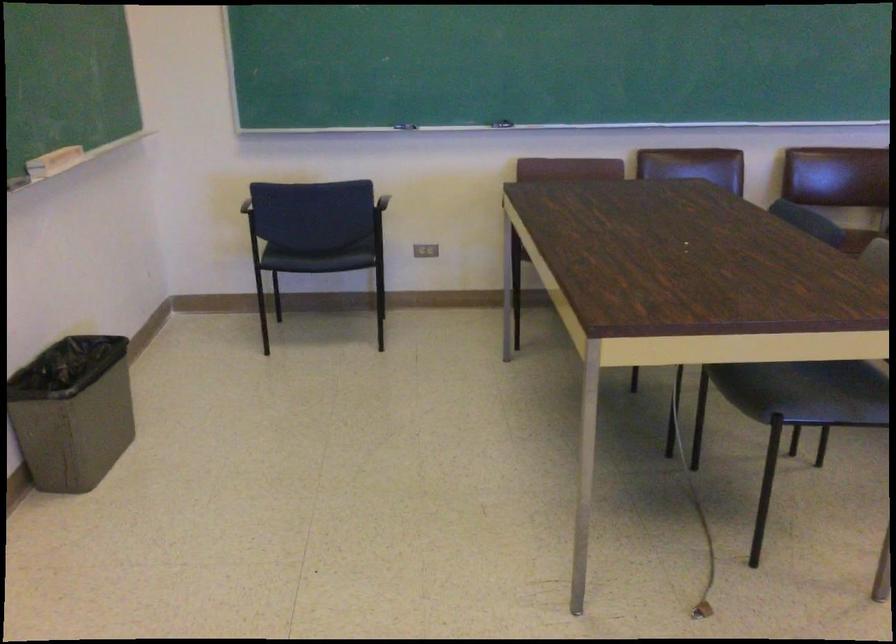
What do you see at coordinates (425, 250) in the screenshot?
I see `the power outlet socket` at bounding box center [425, 250].